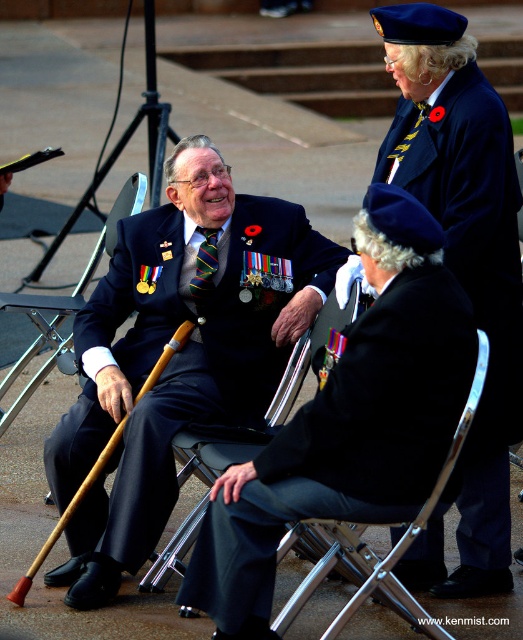
Who is lower down, matte black suit at center or black fabric uniform at center?

black fabric uniform at center is below.

Does matte black suit at center appear over black fabric uniform at center?

Yes.

Who is more distant from viewer, [249,419] or [471,369]?

Point [249,419]

Where is `matte black suit at center`? This screenshot has width=523, height=640. matte black suit at center is located at coordinates (208, 378).

Identify the location of black fabric uniform at center. tap(343, 445).

Is black fabric uniform at center shorter than velvet blue beret at upper right?

A: Yes, black fabric uniform at center is shorter than velvet blue beret at upper right.

Locate an element on the screen. Image resolution: width=523 pixels, height=640 pixels. black fabric uniform at center is located at coordinates (343, 445).

Is velvet blue beret at upper right positioned in front of wooden cane at lower left?

That is True.

Does velvet blue beret at upper right appear on the right side of wooden cane at lower left?

Yes, velvet blue beret at upper right is to the right of wooden cane at lower left.

Which is behind, point (447, 180) or point (56, 333)?

Positioned behind is point (56, 333).

The image size is (523, 640). Find the location of `velvet blue beret at upper right`. velvet blue beret at upper right is located at coordinates (473, 275).